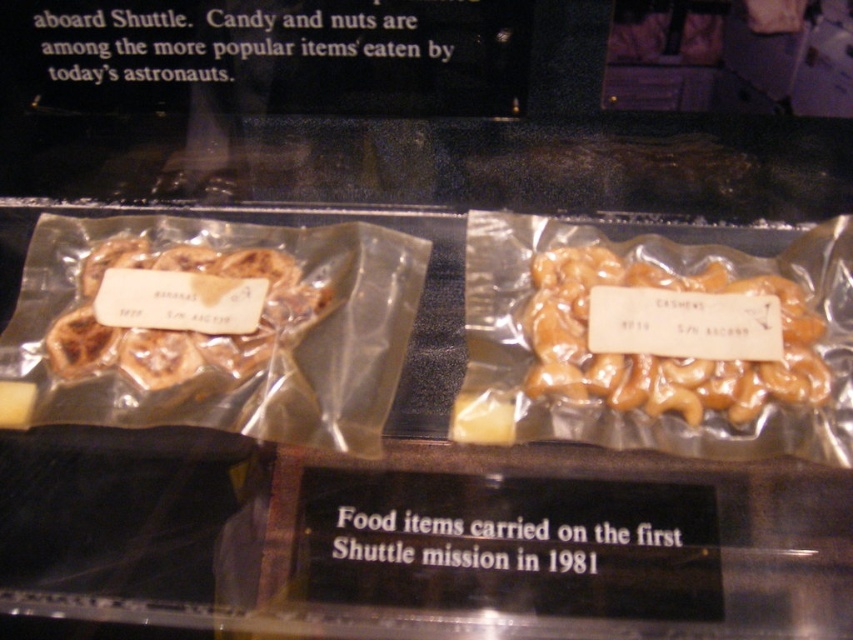
You are an astronaut preparing for a space mission and have to choose between the golden caramel cashews at center and the brown matte cashews at left. Based on their sizes, which bag would you pick if you want a larger portion?

The golden caramel cashews at center has a larger width than the brown matte cashews at left, so you should pick the golden caramel cashews at center for a larger portion.

Based on the coordinates provided in the description, where is the golden caramel cashews at center located in the image?

The golden caramel cashews at center is located at point (663, 355) in the image.

You are an astronaut looking at the display case and want to choose a snack. You see the golden caramel cashews at center and the brown matte cashews at left. Which one is located below the other?

The golden caramel cashews at center is positioned under brown matte cashews at left.